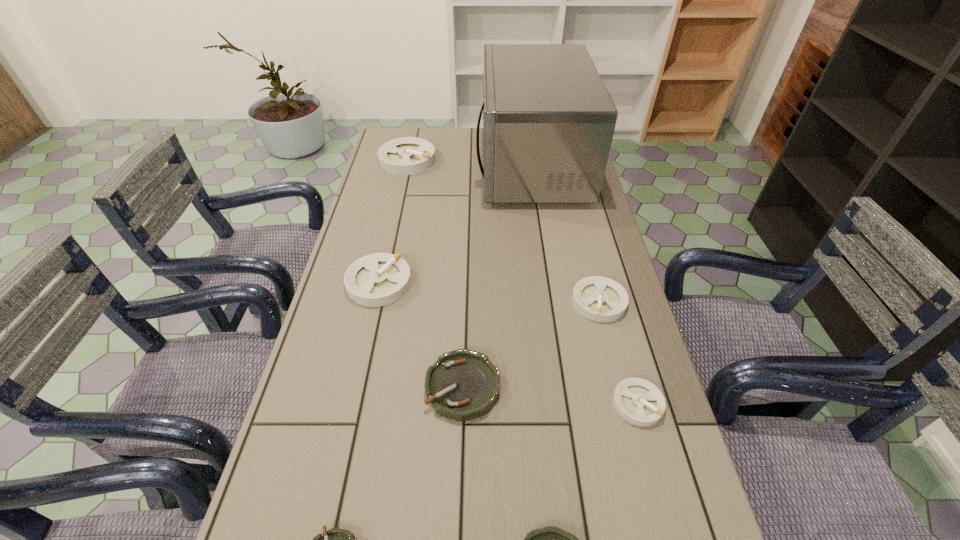
The width and height of the screenshot is (960, 540). Identify the location of vacant region between the third tallest ashtray and the fourth ashtray from right to left. (531, 344).

I want to click on vacant area that lies between the fifth shortest ashtray and the smallest gray ashtray, so click(x=618, y=353).

Find the location of `free space between the fourth ashtray from right to left and the third biggest gray ashtray`. free space between the fourth ashtray from right to left and the third biggest gray ashtray is located at coordinates (531, 344).

The image size is (960, 540). In order to click on free space between the fifth shortest object and the third smallest gray ashtray in this screenshot , I will do `click(489, 292)`.

Find the location of `the closest object to the second smallest gray ashtray`. the closest object to the second smallest gray ashtray is located at coordinates (638, 401).

The height and width of the screenshot is (540, 960). In order to click on the fourth closest object to the fourth ashtray from right to left in this screenshot , I will do `click(601, 299)`.

At what (x,y) coordinates should I click in order to perform the action: click on the fourth closest ashtray to the fifth shortest object. Please return your answer as a coordinate pair (x, y). Looking at the image, I should click on (551, 539).

Identify the location of ashtray identified as the third closest to the microwave oven. This screenshot has height=540, width=960. 601,299.

Identify which gray ashtray is located as the fourth nearest to the biggest green ashtray. Please provide its 2D coordinates. Your answer should be formatted as a tuple, i.e. [(x, y)], where the tuple contains the x and y coordinates of a point satisfying the conditions above.

[(409, 155)]

Locate an element on the screen. The height and width of the screenshot is (540, 960). gray ashtray object that ranks as the third closest to the seventh shortest object is located at coordinates (638, 401).